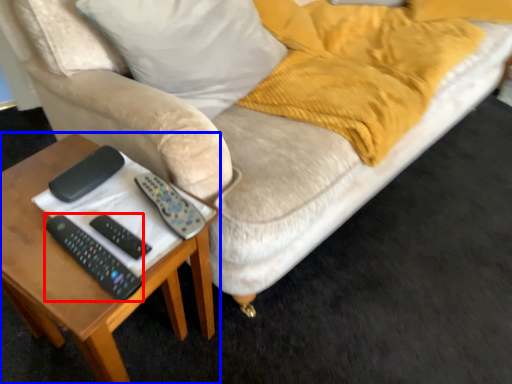
Question: Which object is closer to the camera taking this photo, remote (highlighted by a red box) or table (highlighted by a blue box)?

Choices:
 (A) remote
 (B) table

Answer: (B)